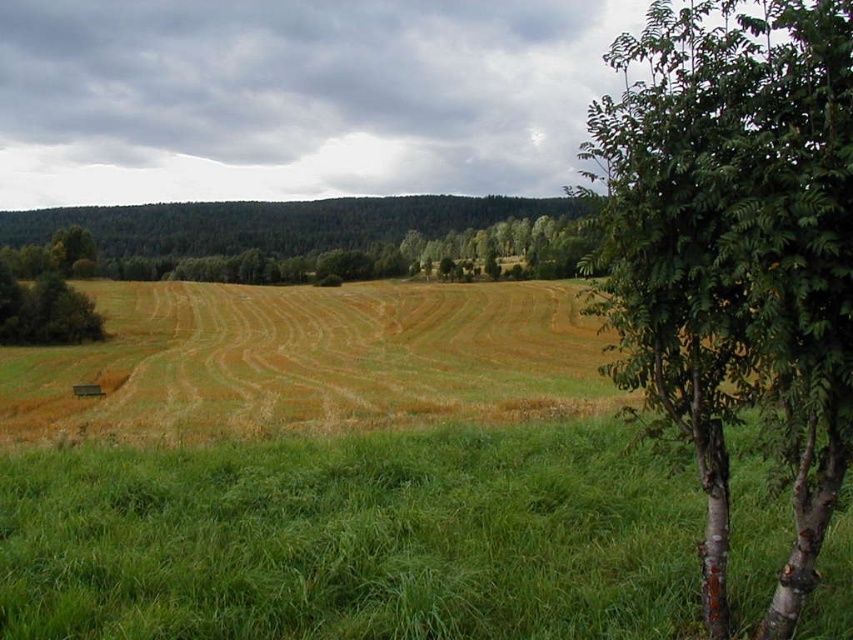
You are a gardener who wants to plant a new flower bed. You have two spots in mind based on the image provided. One is near the green grassy at lower right and the other is near the green leafy tree at left. Which location would you choose if you want your flowers to grow taller?

The green grassy at lower right is shorter than the green leafy tree at left, so planting near the green leafy tree at left would provide more sunlight and space for the flowers to grow taller.

You are standing at the center of the field in the image. If you walk straight ahead, will you reach the green bark birch tree at right before exiting the field? Please explain your reasoning based on the coordinates provided.

The green bark birch tree at right is located at coordinates point (x=735, y=250). Since you are at the center of the field, the distance to the tree would depend on the field dimensions. However, without specific field length data, it is impossible to determine if you reach the tree before exiting the field.